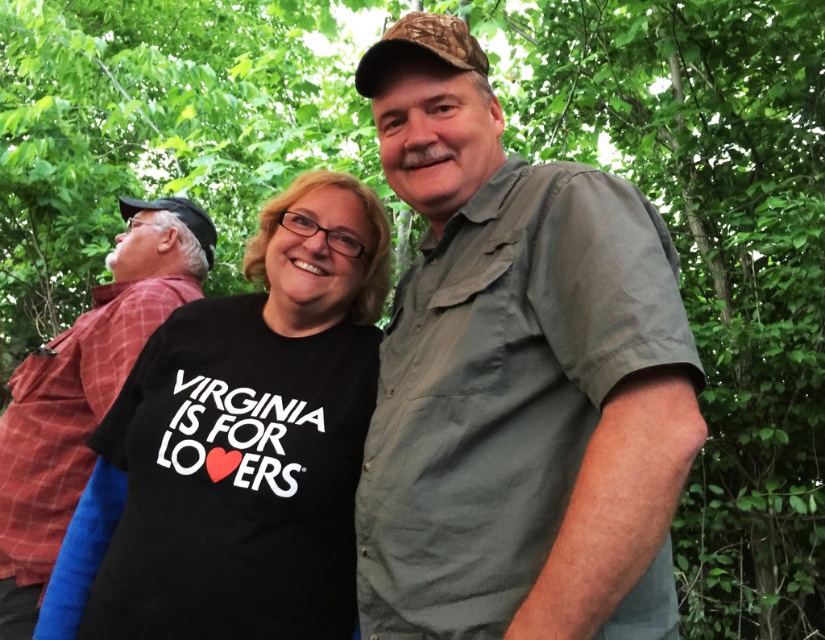
Looking at this image, you are a photographer setting up a tripod in this scene. You want to ensure both the matte gray shirt at center and the red plaid shirt at left are clearly visible in your shot. Which shirt should you focus on first to ensure proper focus, considering their sizes?

The matte gray shirt at center is smaller than the red plaid shirt at left. Since the red plaid shirt at left is larger, it might require more attention to ensure its details are sharp. However, focusing on the matte gray shirt at center first could help achieve clarity for both due to its central position, but ultimately, the photographer should consider the composition and desired emphasis.

You are a photographer trying to capture the matte gray shirt at center and the red plaid shirt at left in a single shot. Which shirt should you focus on first to ensure both are in sharp focus?

You should focus on the matte gray shirt at center first because it is closer to the viewer than the red plaid shirt at left, so focusing on the closer object will help keep both in focus.